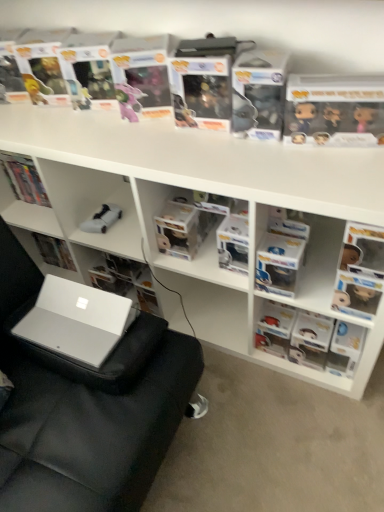
The height and width of the screenshot is (512, 384). What are the coordinates of `vacant space positioned to the left of matte plastic figurine at right, placed as the third book when sorted from left to right` in the screenshot? It's located at (248, 377).